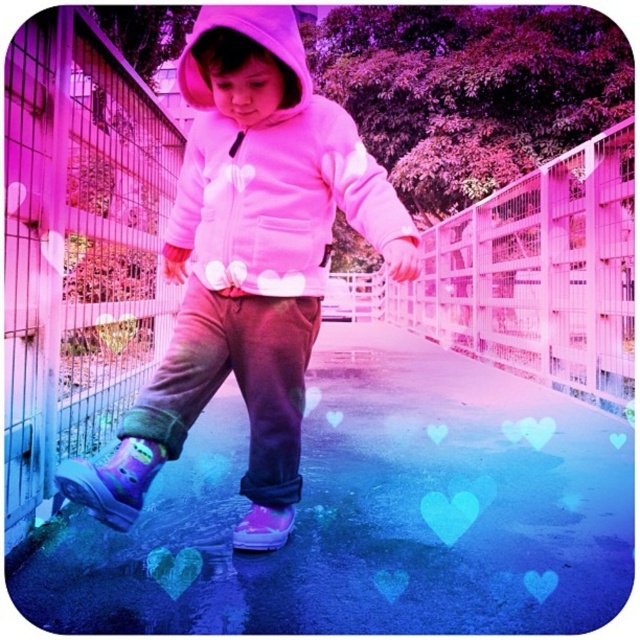
Question: Which point is farther to the camera?

Choices:
 (A) white wire fence at center
 (B) pink fleece hoodie at center

Answer: (A)

Question: Does transparent plastic puddle at center have a lesser width compared to metallic wire fence at left?

Choices:
 (A) no
 (B) yes

Answer: (B)

Question: Estimate the real-world distances between objects in this image. Which object is closer to the light purple rubber boot at lower left?

Choices:
 (A) pink fleece jacket at center
 (B) purple rubber boot at lower center

Answer: (B)

Question: Is transparent plastic puddle at center wider than white wire fence at center?

Choices:
 (A) no
 (B) yes

Answer: (B)

Question: Is the position of metallic wire fence at left more distant than that of purple rubber boot at lower center?

Choices:
 (A) no
 (B) yes

Answer: (A)

Question: Among these points, which one is nearest to the camera?

Choices:
 (A) (115, 480)
 (B) (92, 51)
 (C) (438, 348)

Answer: (A)